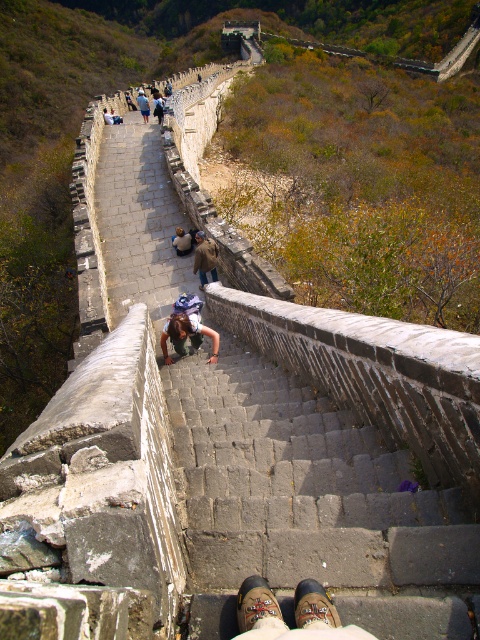
You are standing on the Great Wall and notice two items in the scene. One is brown leather shoes at lower center and the other is blue denim jeans at center. Which item is closer to the ground?

The brown leather shoes at lower center are closer to the ground since they are shorter than the blue denim jeans at center.

You are standing on the Great Wall of China and see the brown leather shoes at lower center and the blue denim jeans at center. Which object is closer to you?

The brown leather shoes at lower center is closer to you because it is positioned in front of the blue denim jeans at center.

You are standing at the point closer to the entrance of the Great Wall and want to reach the observation deck located at the farther end. There are two markers on the path ahead of you labeled as point (297, 547) and point (336, 634). Which point should you head towards to get closer to your destination?

You should head towards point (336, 634) because point (297, 547) is behind it, meaning point (336, 634) is closer to the observation deck at the farther end.